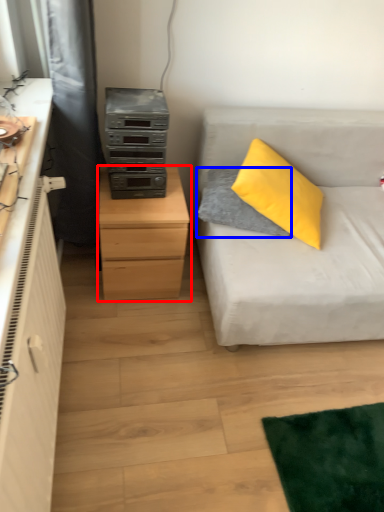
Question: Among these objects, which one is farthest to the camera, chest of drawers (highlighted by a red box) or pillow (highlighted by a blue box)?

Choices:
 (A) chest of drawers
 (B) pillow

Answer: (B)